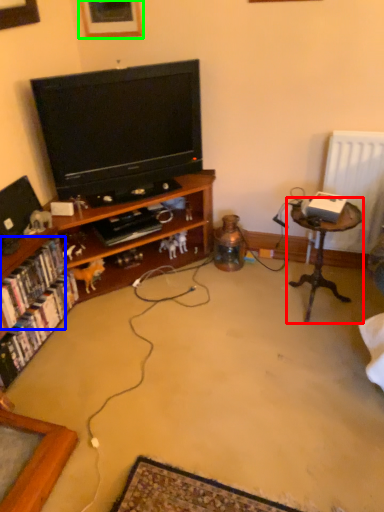
Question: Which object is positioned closest to table (highlighted by a red box)? Select from book (highlighted by a blue box) and picture frame (highlighted by a green box).

Choices:
 (A) book
 (B) picture frame

Answer: (A)